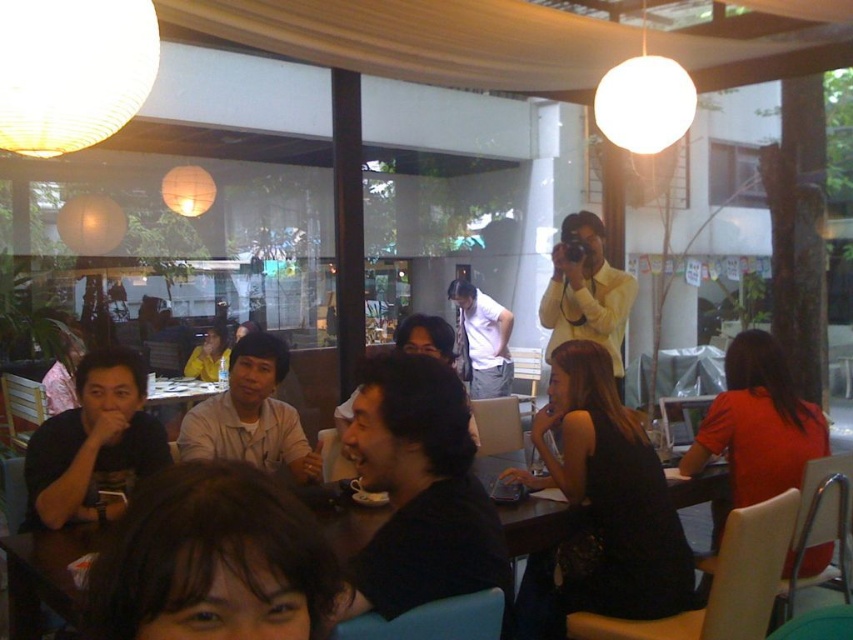
Question: In this image, where is wooden table at center located relative to matte white shirt at center?

Choices:
 (A) above
 (B) below

Answer: (B)

Question: Observing the image, what is the correct spatial positioning of black matte shirt at center in reference to matte white shirt at center?

Choices:
 (A) above
 (B) below

Answer: (B)

Question: Among these points, which one is farthest from the camera?

Choices:
 (A) (337, 572)
 (B) (474, 300)
 (C) (190, 376)

Answer: (B)

Question: Can you confirm if black matte shirt at center is positioned to the right of matte white camera at upper center?

Choices:
 (A) no
 (B) yes

Answer: (A)

Question: Among these objects, which one is farthest from the camera?

Choices:
 (A) black matte shirt at center
 (B) dark brown hair at center
 (C) matte white camera at upper center
 (D) yellow matte shirt at center

Answer: (D)

Question: Among these objects, which one is nearest to the camera?

Choices:
 (A) black matte shirt at center
 (B) black matte shirt at left
 (C) light brown casual shirt at center
 (D) dark brown hair at center

Answer: (D)